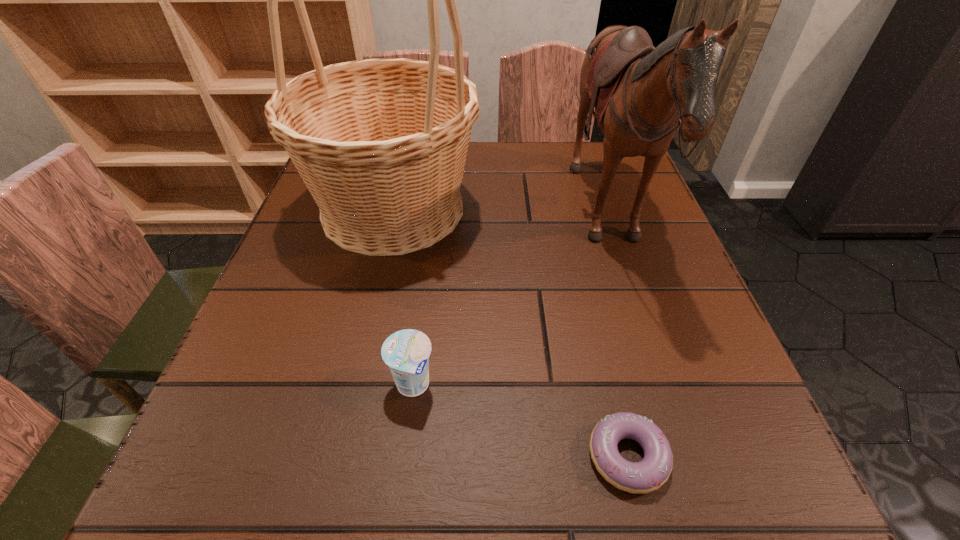
At what (x,y) coordinates should I click in order to perform the action: click on vacant space that is in between the third farthest object and the second tallest object. Please return your answer as a coordinate pair (x, y). Looking at the image, I should click on (510, 302).

Identify the location of empty location between the doughnut and the second nearest object. (520, 421).

Identify the location of unoccupied position between the third shortest object and the nearest object. (617, 338).

You are a GUI agent. You are given a task and a screenshot of the screen. Output one action in this format:
    pyautogui.click(x=<x>, y=<y>)
    Task: Click on the vacant region between the yogurt and the second tallest object
    The image size is (960, 540).
    Given the screenshot: What is the action you would take?
    pyautogui.click(x=510, y=302)

At what (x,y) coordinates should I click in order to perform the action: click on vacant area that lies between the doughnut and the third farthest object. Please return your answer as a coordinate pair (x, y). Image resolution: width=960 pixels, height=540 pixels. Looking at the image, I should click on (520, 421).

I want to click on object that ranks as the third closest to the tallest object, so click(x=649, y=474).

Identify which object is the second nearest to the third tallest object. Please provide its 2D coordinates. Your answer should be formatted as a tuple, i.e. [(x, y)], where the tuple contains the x and y coordinates of a point satisfying the conditions above.

[(381, 144)]

In order to click on vacant space that satisfies the following two spatial constraints: 1. on the front side of the second nearest object; 2. on the right side of the basket in this screenshot , I will do `click(352, 385)`.

At what (x,y) coordinates should I click in order to perform the action: click on free space that satisfies the following two spatial constraints: 1. on the back of the saddle; 2. on the front side of the doughnut. Please return your answer as a coordinate pair (x, y). The image size is (960, 540). Looking at the image, I should click on (686, 456).